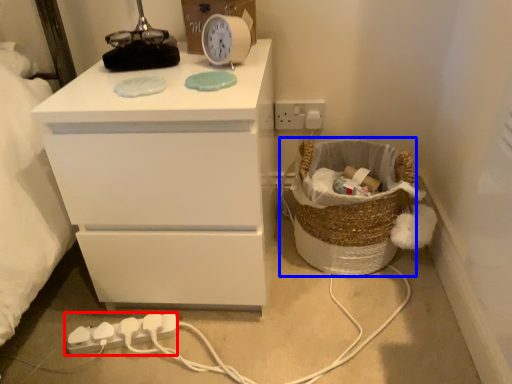
Question: Which object is closer to the camera taking this photo, extension cord (highlighted by a red box) or basket (highlighted by a blue box)?

Choices:
 (A) extension cord
 (B) basket

Answer: (B)